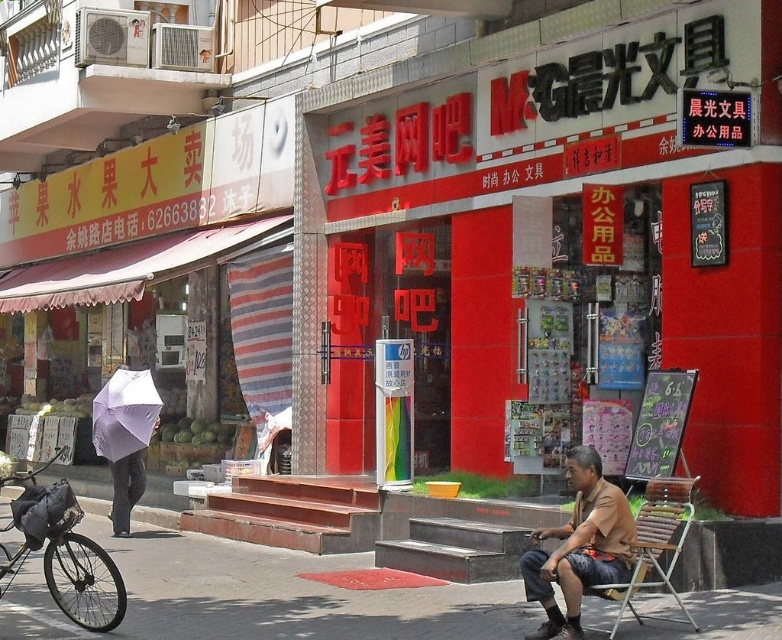
Question: Which object is the farthest from the white matte umbrella at left?

Choices:
 (A) gray concrete pavement at lower center
 (B) brown cotton shirt at lower right
 (C) dark gray pants at left
 (D) black matte bicycle at lower left

Answer: (B)

Question: Is the position of gray concrete pavement at lower center less distant than that of white matte umbrella at left?

Choices:
 (A) yes
 (B) no

Answer: (A)

Question: Which object is closer to the camera taking this photo?

Choices:
 (A) wooden folding chair at lower right
 (B) black matte bicycle at lower left

Answer: (A)

Question: Does black matte bicycle at lower left have a larger size compared to white matte umbrella at left?

Choices:
 (A) yes
 (B) no

Answer: (A)

Question: Does gray concrete pavement at lower center have a smaller size compared to dark gray pants at left?

Choices:
 (A) no
 (B) yes

Answer: (B)

Question: Which of the following is the closest to the observer?

Choices:
 (A) (67, 499)
 (B) (135, 477)

Answer: (A)